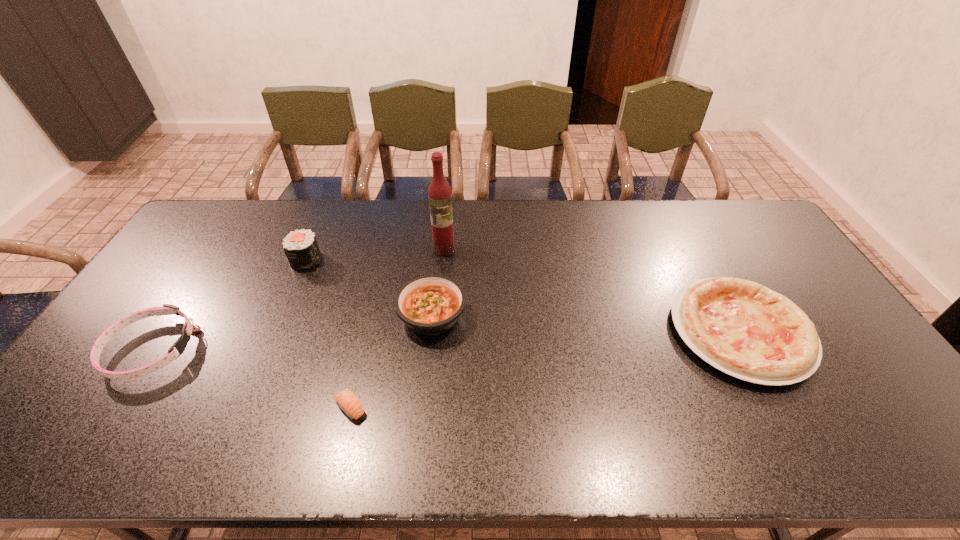
Locate an element on the screen. This screenshot has width=960, height=540. the tallest object is located at coordinates (439, 192).

Identify the location of the taller sushi. click(301, 249).

Identify the location of the second object from left to right. The image size is (960, 540). (301, 249).

Where is `stew`? This screenshot has height=540, width=960. stew is located at coordinates (431, 304).

This screenshot has width=960, height=540. Find the location of `pizza`. pizza is located at coordinates (744, 329).

Identify the location of dog collar. (168, 309).

In order to click on the shorter sushi in this screenshot , I will do `click(348, 402)`.

You are a GUI agent. You are given a task and a screenshot of the screen. Output one action in this format:
    pyautogui.click(x=<x>, y=<y>)
    Task: Click on the nearer sushi
    The image size is (960, 540).
    Given the screenshot: What is the action you would take?
    pyautogui.click(x=348, y=402)

You are a GUI agent. You are given a task and a screenshot of the screen. Output one action in this format:
    pyautogui.click(x=<x>, y=<y>)
    Task: Click on the blank space located on the label of the liquor
    This screenshot has height=540, width=960.
    Given the screenshot: What is the action you would take?
    pyautogui.click(x=439, y=307)

The image size is (960, 540). Find the location of `vacant space situated 0.360m on the front of the second object from left to right`. vacant space situated 0.360m on the front of the second object from left to right is located at coordinates (262, 364).